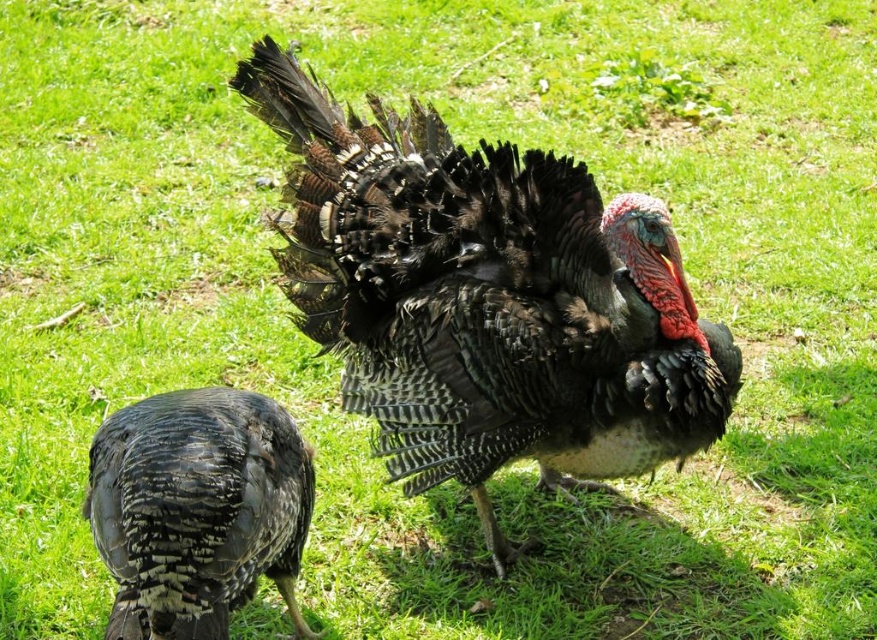
Question: Considering the relative positions of shiny black turkey at center and shiny black feathers at lower left in the image provided, where is shiny black turkey at center located with respect to shiny black feathers at lower left?

Choices:
 (A) left
 (B) right

Answer: (B)

Question: Which point is closer to the camera?

Choices:
 (A) [x=204, y=412]
 (B) [x=619, y=340]

Answer: (A)

Question: Considering the relative positions of shiny black turkey at center and shiny black feathers at lower left in the image provided, where is shiny black turkey at center located with respect to shiny black feathers at lower left?

Choices:
 (A) right
 (B) left

Answer: (A)

Question: Does shiny black turkey at center have a smaller size compared to shiny black feathers at lower left?

Choices:
 (A) no
 (B) yes

Answer: (A)

Question: Which of the following is the closest to the observer?

Choices:
 (A) (439, 474)
 (B) (179, 540)

Answer: (B)

Question: Among these points, which one is nearest to the camera?

Choices:
 (A) click(497, 189)
 (B) click(138, 592)

Answer: (B)